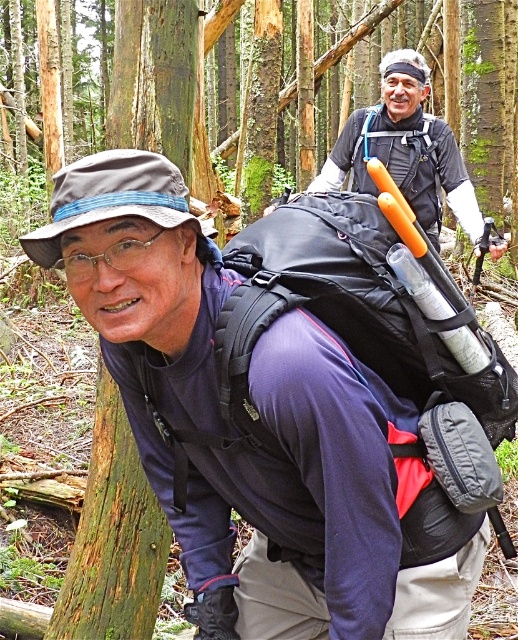
Can you confirm if matte black backpack at center is bigger than black fabric backpack at center?

Correct, matte black backpack at center is larger in size than black fabric backpack at center.

Who is taller, matte black backpack at center or black fabric backpack at center?

matte black backpack at center is taller.

Is point (117, 332) more distant than point (393, 342)?

No, (117, 332) is closer to viewer.

At what (x,y) coordinates should I click in order to perform the action: click on matte black backpack at center. Please return your answer as a coordinate pair (x, y). This screenshot has height=640, width=518. Looking at the image, I should click on (260, 419).